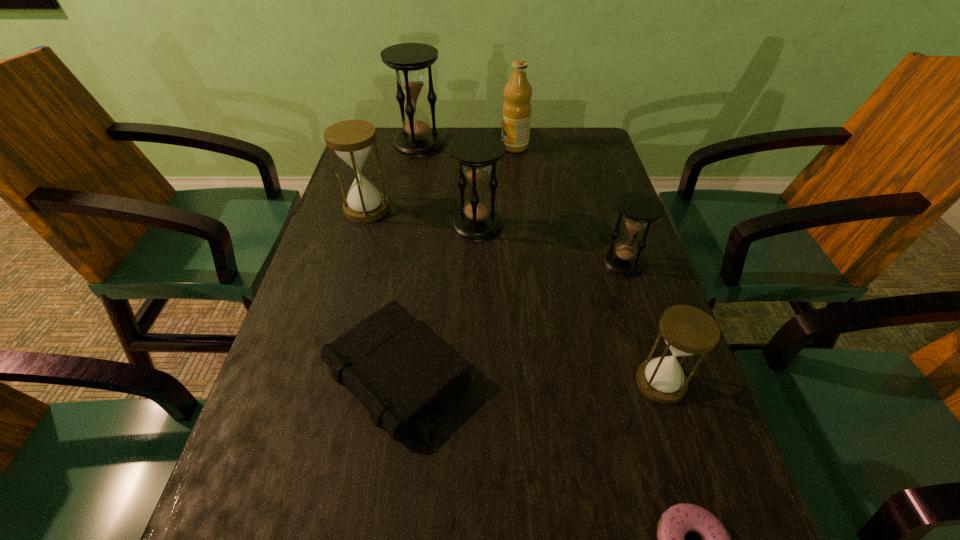
Image resolution: width=960 pixels, height=540 pixels. What are the coordinates of `the nearer white hourglass` in the screenshot? It's located at (687, 330).

This screenshot has width=960, height=540. In order to click on the second shortest object in this screenshot , I will do `click(400, 371)`.

Where is `vacant point located 0.070m on the front of the farthest black hourglass`? This screenshot has height=540, width=960. vacant point located 0.070m on the front of the farthest black hourglass is located at coordinates (414, 170).

At what (x,y) coordinates should I click in order to perform the action: click on vacant space situated on the label of the olive oil. Please return your answer as a coordinate pair (x, y). The image size is (960, 540). Looking at the image, I should click on (387, 146).

Locate an element on the screen. free spot located 0.350m on the label of the olive oil is located at coordinates (387, 146).

Find the location of `free point located on the label of the olive oil`. free point located on the label of the olive oil is located at coordinates (471, 146).

In order to click on vacant space situated on the right of the second farthest black hourglass in this screenshot , I will do `click(522, 225)`.

Find the location of a particular element. The height and width of the screenshot is (540, 960). vacant point located on the back of the left white hourglass is located at coordinates (388, 137).

I want to click on vacant space situated on the front of the smallest black hourglass, so click(660, 377).

The height and width of the screenshot is (540, 960). I want to click on vacant space situated on the back of the nearer white hourglass, so [x=643, y=327].